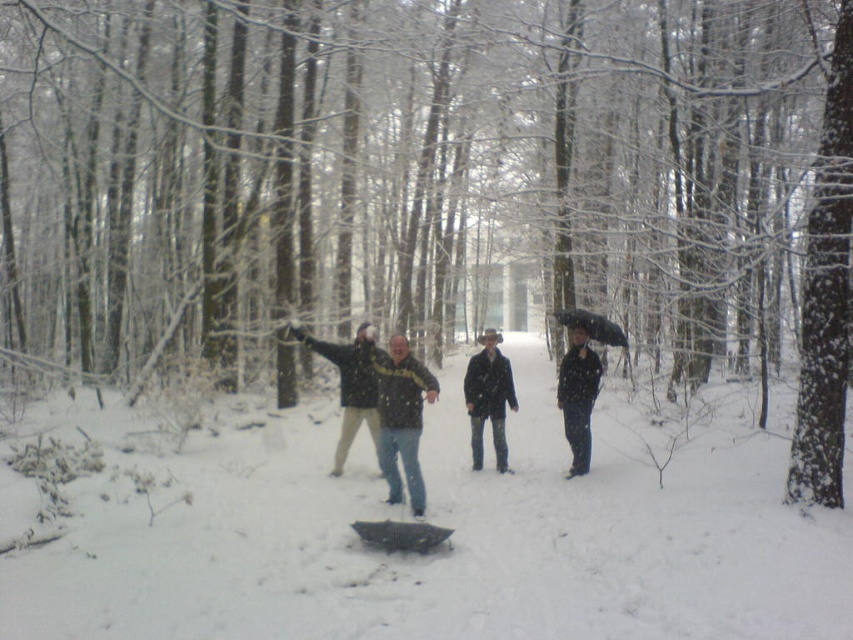
From the picture: Who is more distant from viewer, (494, 424) or (572, 435)?

Point (494, 424)

Who is more distant from viewer, (480, 355) or (585, 461)?

The point (480, 355) is behind.

Image resolution: width=853 pixels, height=640 pixels. I want to click on dark blue jeans at center, so click(488, 397).

Is white fluffy snow at center below dark blue jeans at center?

Indeed, white fluffy snow at center is positioned under dark blue jeans at center.

Does point (183, 518) come behind point (497, 412)?

No, (183, 518) is in front of (497, 412).

Does point (225, 476) come farther from viewer compared to point (492, 369)?

That is False.

I want to click on white fluffy snow at center, so click(453, 538).

Is matte black jacket at center wider than dark blue jeans at center?

Indeed, matte black jacket at center has a greater width compared to dark blue jeans at center.

Can you confirm if matte black jacket at center is shorter than dark blue jeans at center?

In fact, matte black jacket at center may be taller than dark blue jeans at center.

What do you see at coordinates (401, 417) in the screenshot? This screenshot has width=853, height=640. I see `matte black jacket at center` at bounding box center [401, 417].

Find the location of a particular element. The height and width of the screenshot is (640, 853). matte black jacket at center is located at coordinates (401, 417).